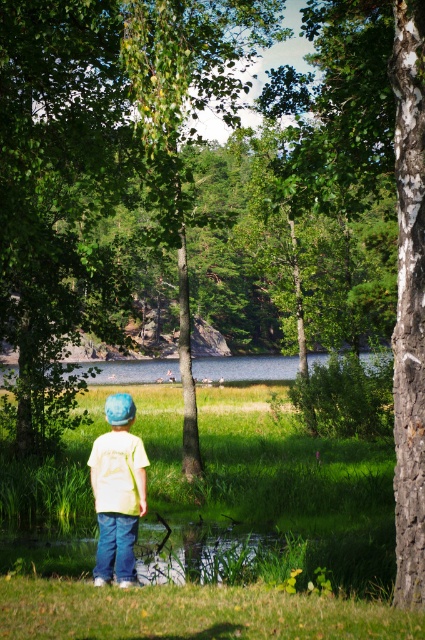
Measure the distance from green grass at lower center to light yellow t-shirt at center.

4.74 feet

Which of these two, green grass at lower center or light yellow t-shirt at center, stands shorter?

With less height is green grass at lower center.

Does point (289, 602) come in front of point (107, 538)?

Yes.

The width and height of the screenshot is (425, 640). Find the location of `green grass at lower center`. green grass at lower center is located at coordinates (190, 612).

Is green grass at lower center to the left of clear blue water at center from the viewer's perspective?

No, green grass at lower center is not to the left of clear blue water at center.

Based on the photo, can you confirm if green grass at lower center is smaller than clear blue water at center?

Indeed, green grass at lower center has a smaller size compared to clear blue water at center.

Who is more forward, (0, 632) or (88, 380)?

Point (0, 632) is in front.

Find the location of a particular element. This screenshot has width=425, height=640. green grass at lower center is located at coordinates (190, 612).

Is light yellow t-shirt at center to the right of clear blue water at center from the viewer's perspective?

Indeed, light yellow t-shirt at center is positioned on the right side of clear blue water at center.

Is point (132, 413) positioned behind point (251, 362)?

No, (132, 413) is in front of (251, 362).

Find the location of a particular element. The image size is (425, 640). light yellow t-shirt at center is located at coordinates (118, 492).

The image size is (425, 640). Find the location of `light yellow t-shirt at center`. light yellow t-shirt at center is located at coordinates (118, 492).